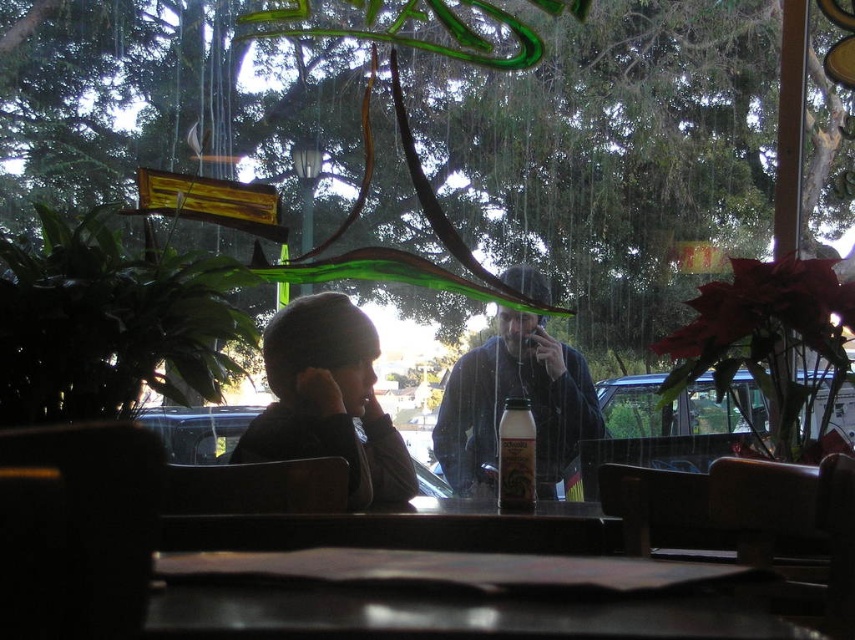
Question: Does smooth wooden table at center have a larger size compared to dark blue sweater at center?

Choices:
 (A) yes
 (B) no

Answer: (B)

Question: In this image, where is dark blue sweater at center located relative to white matte bottle at center?

Choices:
 (A) left
 (B) right

Answer: (B)

Question: Which object is closer to the camera taking this photo?

Choices:
 (A) smooth wooden table at center
 (B) dark blue sweater at center
 (C) white matte bottle at center
 (D) dark gray knit hat at left

Answer: (A)

Question: Which point is closer to the camera?

Choices:
 (A) (699, 589)
 (B) (506, 508)

Answer: (A)

Question: Does smooth wooden table at center lie behind dark blue sweater at center?

Choices:
 (A) no
 (B) yes

Answer: (A)

Question: Which of the following is the farthest from the observer?

Choices:
 (A) dark blue sweater at center
 (B) dark gray knit hat at left

Answer: (A)